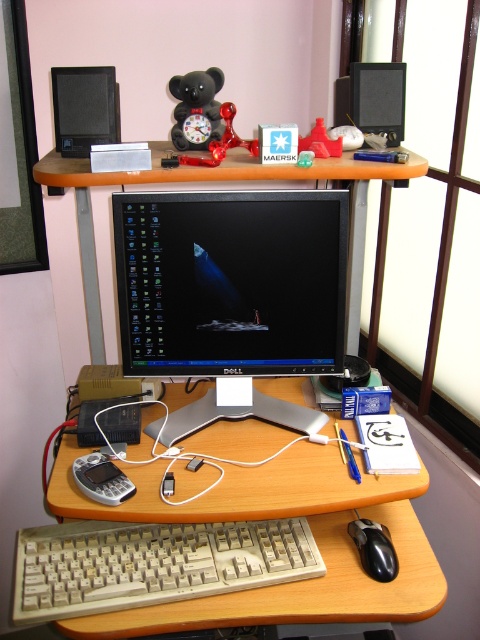
Question: Which object appears farthest from the camera in this image?

Choices:
 (A) black plastic mouse at lower right
 (B) beige plastic keyboard at lower center
 (C) black matte bear at upper center

Answer: (C)

Question: Does beige wood computer desk at center have a smaller size compared to translucent plastic bear at upper center?

Choices:
 (A) no
 (B) yes

Answer: (A)

Question: Is black glossy monitor at center wider than glossy plastic bear at upper center?

Choices:
 (A) yes
 (B) no

Answer: (A)

Question: Can you confirm if wooden desk at center is bigger than black matte speaker at upper left?

Choices:
 (A) no
 (B) yes

Answer: (B)

Question: Considering the real-world distances, which object is closest to the black glossy monitor at center?

Choices:
 (A) beige wood computer desk at center
 (B) beige plastic keyboard at lower center
 (C) black matte speaker at upper right

Answer: (A)

Question: Which of the following is the closest to the observer?

Choices:
 (A) glossy plastic bear at upper center
 (B) black matte speaker at upper right
 (C) black glossy monitor at center

Answer: (C)